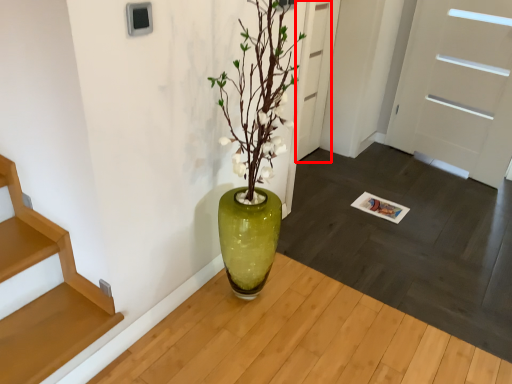
Question: From the image's perspective, where is door (annotated by the red box) located in relation to door in the image?

Choices:
 (A) above
 (B) below

Answer: (A)